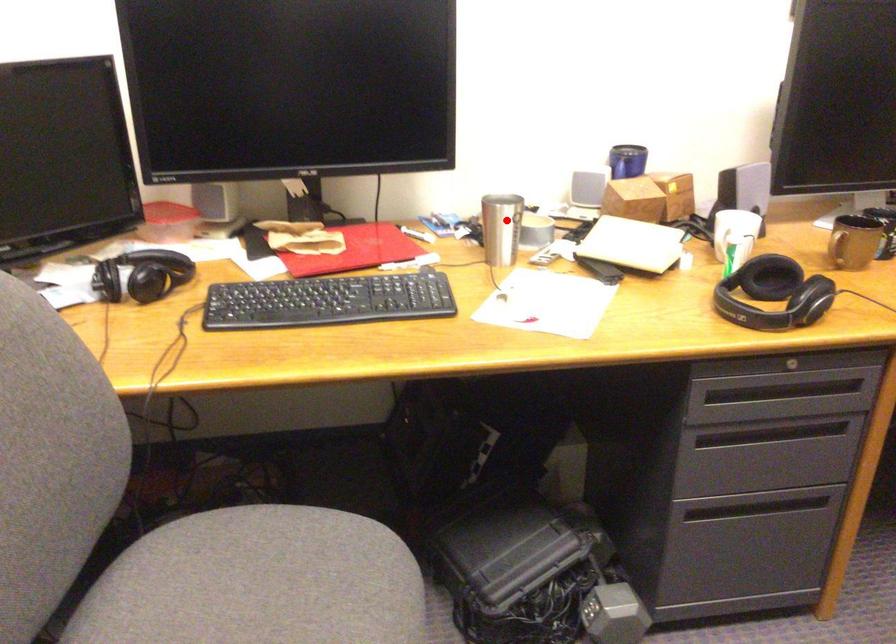
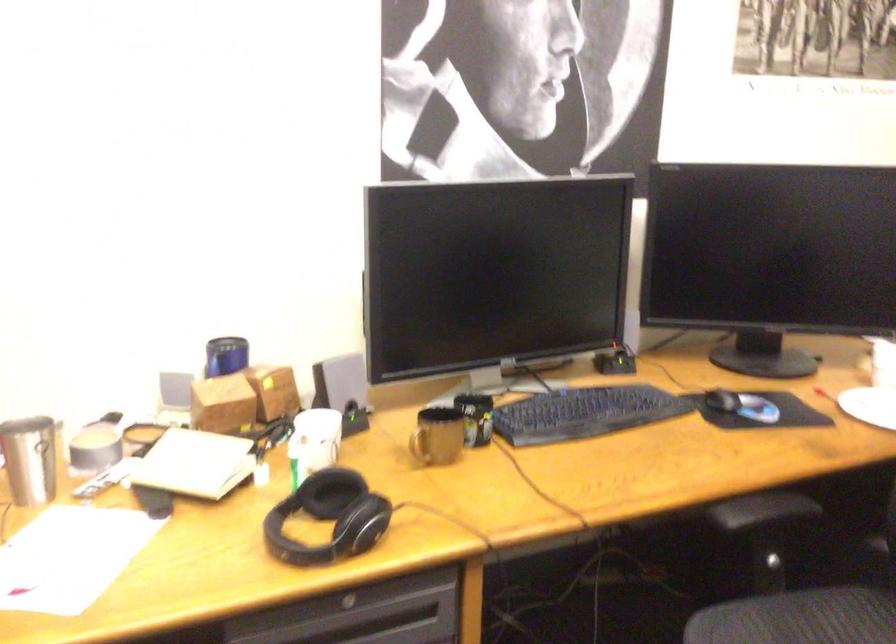
In the second image, find the point that corresponds to the highlighted location in the first image.

(30, 459)